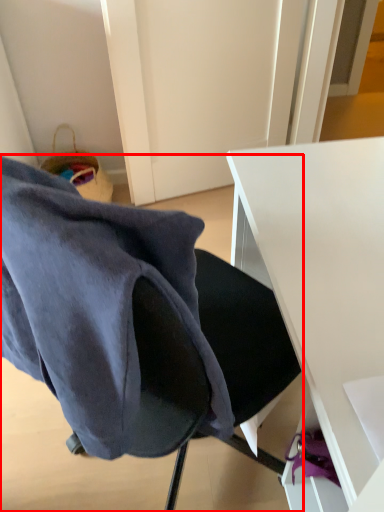
Question: Considering the relative positions of chair (annotated by the red box) and desk in the image provided, where is chair (annotated by the red box) located with respect to the staircase?

Choices:
 (A) right
 (B) left

Answer: (B)